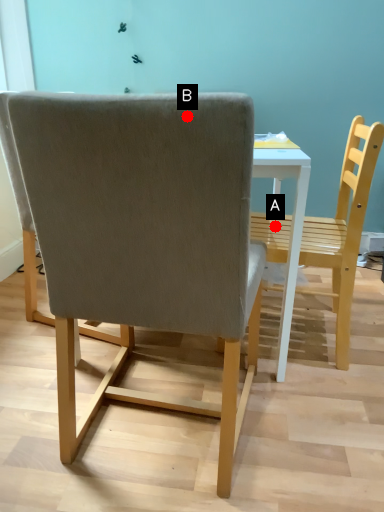
Question: Two points are circled on the image, labeled by A and B beside each circle. Which point is closer to the camera?

Choices:
 (A) A is closer
 (B) B is closer

Answer: (B)